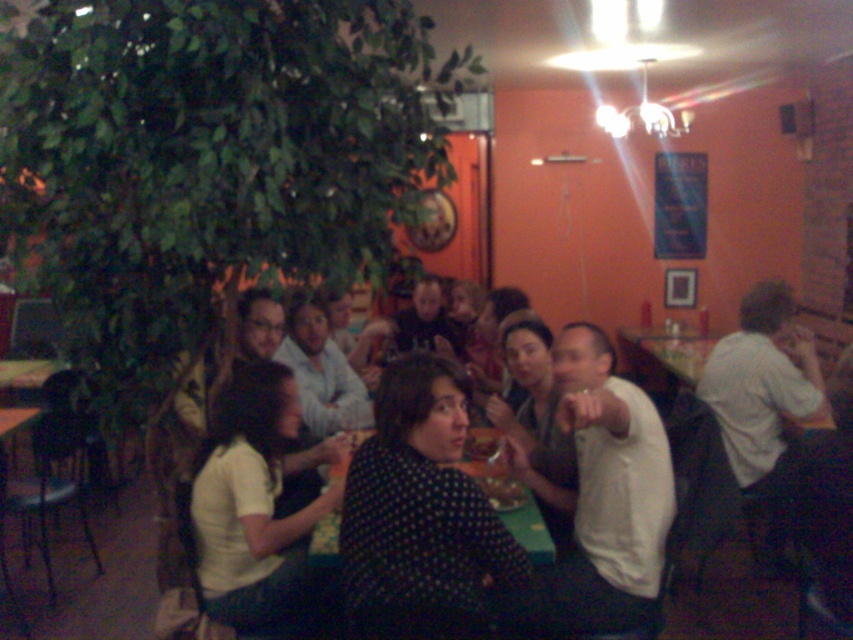
Question: Which object is closer to the camera taking this photo?

Choices:
 (A) polka dot shirt at center
 (B) white matte shirt at lower left
 (C) white matte shirt at center

Answer: (A)

Question: Which point is closer to the camera?

Choices:
 (A) polka dot shirt at center
 (B) green fabric table at center

Answer: (A)

Question: Does polka dot shirt at center come in front of white matte shirt at lower left?

Choices:
 (A) yes
 (B) no

Answer: (A)

Question: Considering the relative positions of polka dot shirt at center and white matte shirt at lower left in the image provided, where is polka dot shirt at center located with respect to white matte shirt at lower left?

Choices:
 (A) left
 (B) right

Answer: (B)

Question: Estimate the real-world distances between objects in this image. Which object is closer to the white matte shirt at lower left?

Choices:
 (A) green fabric table at center
 (B) polka dot shirt at center
 (C) white matte shirt at center

Answer: (B)

Question: Is white matte shirt at center to the right of white matte shirt at lower left from the viewer's perspective?

Choices:
 (A) no
 (B) yes

Answer: (B)